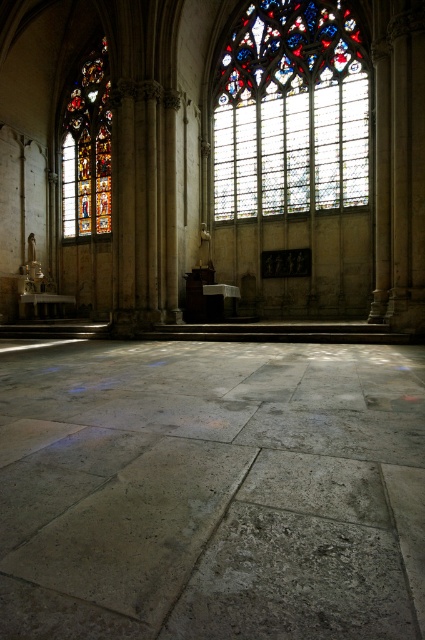
Who is lower down, stained glass window at center or stained glass window at left?

stained glass window at center is below.

Is point (302, 154) farther from camera compared to point (65, 145)?

That is False.

Identify the location of stained glass window at center. This screenshot has height=640, width=425. (291, 112).